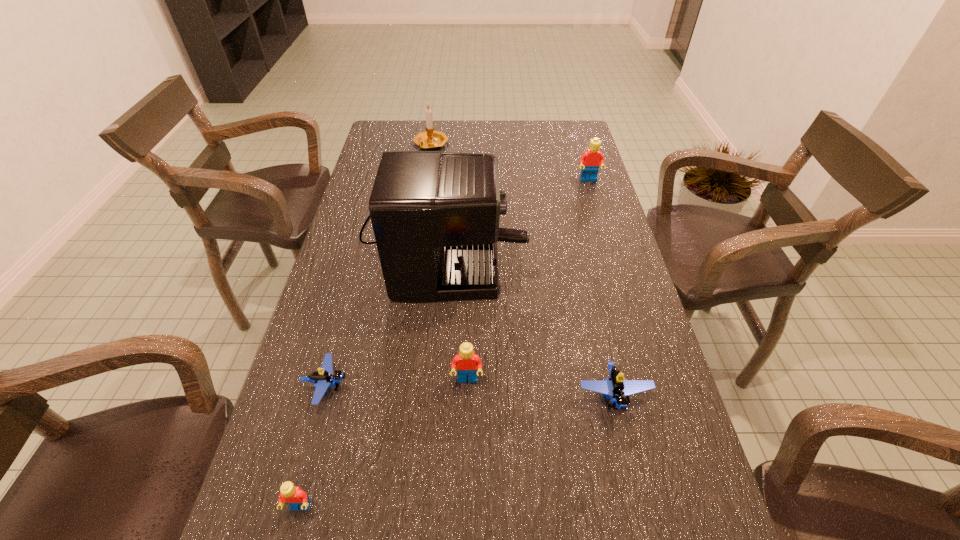
Find the location of a particular element. The image size is (960, 540). coffee maker is located at coordinates (435, 215).

The width and height of the screenshot is (960, 540). Identify the location of the tallest object. (435, 215).

The width and height of the screenshot is (960, 540). I want to click on the farthest object, so click(430, 139).

Find the location of `gold candle holder`. gold candle holder is located at coordinates (430, 139).

This screenshot has width=960, height=540. In order to click on the biggest red Lego in this screenshot , I will do pyautogui.click(x=590, y=161).

Identify the location of the rightmost red Lego. The image size is (960, 540). (590, 161).

Where is `the third Lego from right to left`? This screenshot has height=540, width=960. the third Lego from right to left is located at coordinates (467, 362).

This screenshot has height=540, width=960. Identify the location of the second biggest red Lego. (467, 362).

Where is `the right blue Lego`? the right blue Lego is located at coordinates (619, 390).

I want to click on the nearest red Lego, so click(295, 497).